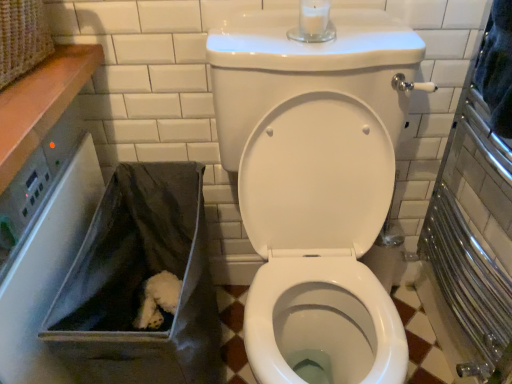
Question: From the image's perspective, is gray fabric bag at lower left below white glossy toilet at center?

Choices:
 (A) yes
 (B) no

Answer: (A)

Question: Is gray fabric bag at lower left taller than white glossy toilet at center?

Choices:
 (A) no
 (B) yes

Answer: (A)

Question: Considering the relative sizes of gray fabric bag at lower left and white glossy toilet at center in the image provided, is gray fabric bag at lower left thinner than white glossy toilet at center?

Choices:
 (A) no
 (B) yes

Answer: (B)

Question: Does gray fabric bag at lower left appear on the left side of white glossy toilet at center?

Choices:
 (A) yes
 (B) no

Answer: (A)

Question: Is gray fabric bag at lower left touching white glossy toilet at center?

Choices:
 (A) no
 (B) yes

Answer: (A)

Question: From the image's perspective, is gray fabric bag at lower left above white glossy toilet at center?

Choices:
 (A) yes
 (B) no

Answer: (B)

Question: Considering the relative sizes of white glossy toilet at center and gray fabric bag at lower left in the image provided, is white glossy toilet at center shorter than gray fabric bag at lower left?

Choices:
 (A) yes
 (B) no

Answer: (B)

Question: From a real-world perspective, is white glossy toilet at center positioned over gray fabric bag at lower left based on gravity?

Choices:
 (A) yes
 (B) no

Answer: (A)

Question: Is white glossy toilet at center bigger than gray fabric bag at lower left?

Choices:
 (A) yes
 (B) no

Answer: (A)

Question: Can you confirm if white glossy toilet at center is thinner than gray fabric bag at lower left?

Choices:
 (A) no
 (B) yes

Answer: (A)

Question: Is white glossy toilet at center positioned with its back to gray fabric bag at lower left?

Choices:
 (A) yes
 (B) no

Answer: (B)

Question: Is white glossy toilet at center positioned before gray fabric bag at lower left?

Choices:
 (A) no
 (B) yes

Answer: (B)

Question: Is point (150, 362) closer or farther from the camera than point (308, 69)?

Choices:
 (A) closer
 (B) farther

Answer: (A)